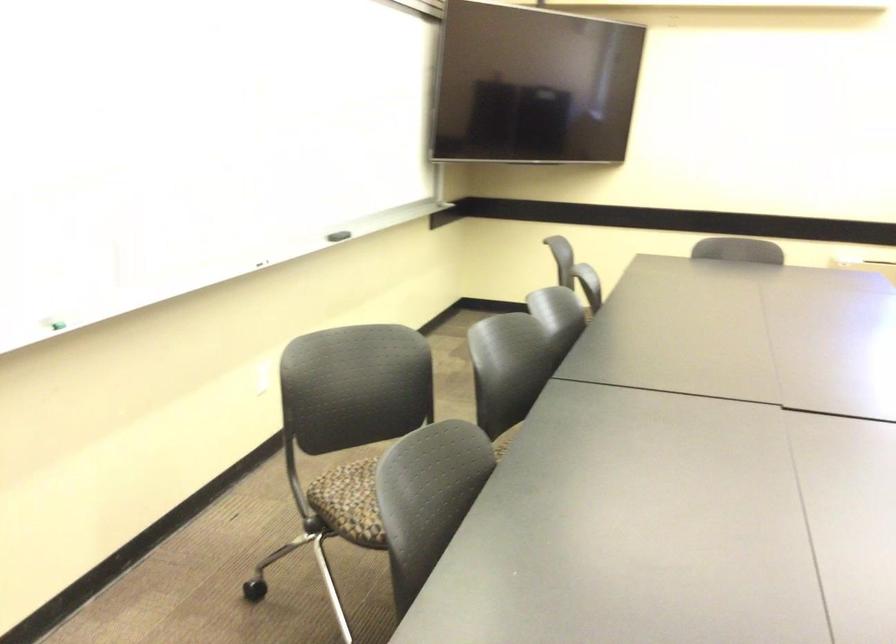
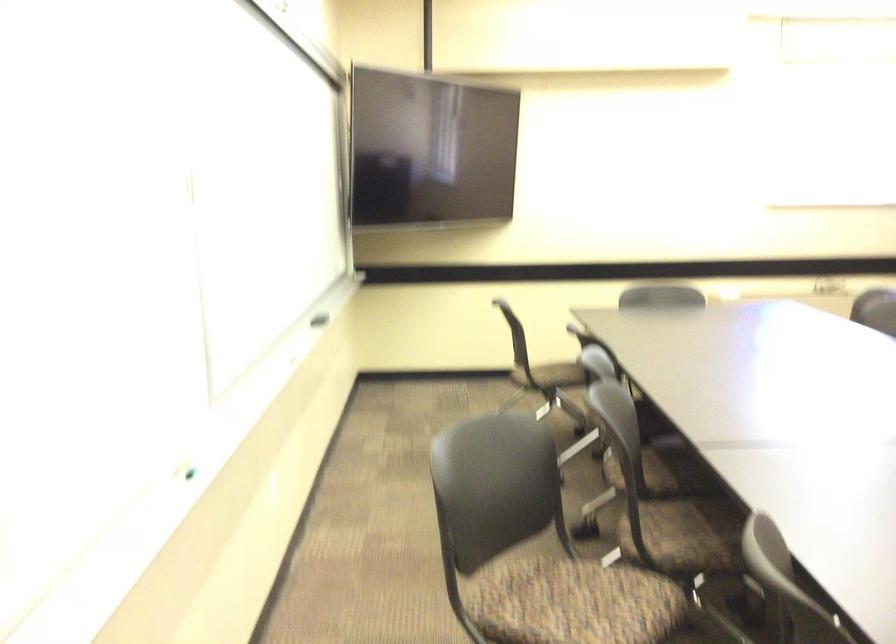
In a continuous first-person perspective shot, in which direction is the camera moving?

The cameraman walked toward left, forward.